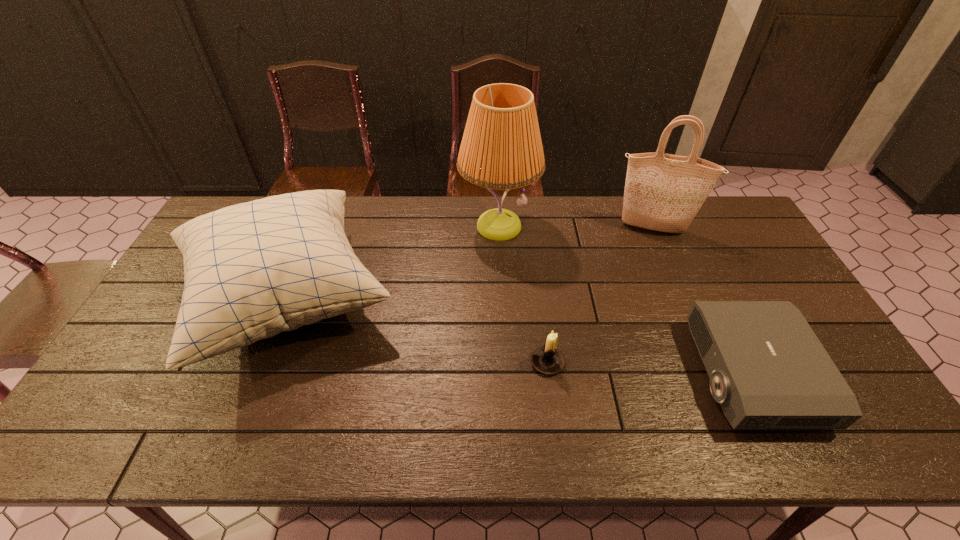
Identify the location of free region located 0.390m on the front-facing side of the projector. (547, 373).

The image size is (960, 540). What are the coordinates of `free location located 0.290m on the front-facing side of the projector` in the screenshot? It's located at (587, 373).

This screenshot has width=960, height=540. In order to click on free space located 0.230m on the front-facing side of the projector in this screenshot , I will do `click(610, 373)`.

Identify the location of lamp present at the far edge. The image size is (960, 540). (501, 148).

Locate an element on the screen. shopping bag at the far edge is located at coordinates (663, 192).

Image resolution: width=960 pixels, height=540 pixels. I want to click on cushion that is at the far edge, so click(253, 270).

Locate an element on the screen. Image resolution: width=960 pixels, height=540 pixels. object positioned at the near edge is located at coordinates (768, 370).

Where is `object that is at the left edge`? The image size is (960, 540). object that is at the left edge is located at coordinates (253, 270).

Where is `object present at the right edge`? This screenshot has height=540, width=960. object present at the right edge is located at coordinates (768, 370).

Find the location of a particular element. object that is positioned at the far left corner is located at coordinates (253, 270).